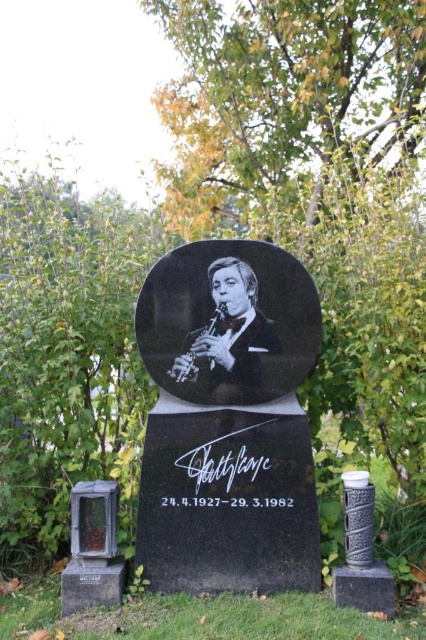
Does black polished stone plaque at center have a lesser height compared to black glossy portrait at center?

Incorrect, black polished stone plaque at center's height does not fall short of black glossy portrait at center's.

Does point (299, 380) lie in front of point (222, 381)?

That is True.

Is point (244, 516) positioned behind point (244, 294)?

No, (244, 516) is closer to viewer.

Identify the location of black polished stone plaque at center. (227, 420).